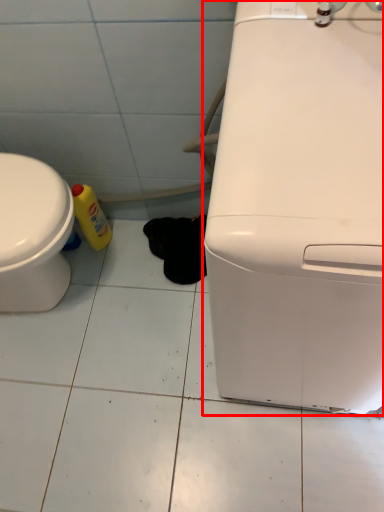
Question: From the image's perspective, where is home appliance (annotated by the red box) located in relation to bottle in the image?

Choices:
 (A) above
 (B) below

Answer: (B)